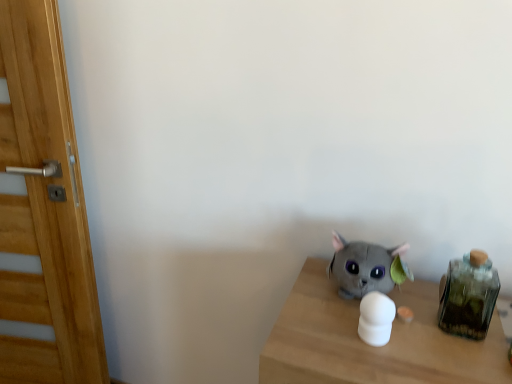
Question: Would you say white matte object at center, which is counted as the first toy, starting from the front, is to the left or to the right of wooden door at left in the picture?

Choices:
 (A) left
 (B) right

Answer: (B)

Question: In terms of height, does white matte object at center, the second toy viewed from the back, look taller or shorter compared to wooden door at left?

Choices:
 (A) short
 (B) tall

Answer: (A)

Question: Which object is positioned closest to the wooden door at left?

Choices:
 (A) green glass jar at right
 (B) soft gray plush cat at center, which is counted as the 1th toy, starting from the back
 (C) white matte object at center, the second toy viewed from the back

Answer: (B)

Question: Which object is the farthest from the white matte object at center, which is counted as the first toy, starting from the front?

Choices:
 (A) soft gray plush cat at center, which is counted as the 1th toy, starting from the back
 (B) wooden door at left
 (C) green glass jar at right

Answer: (B)